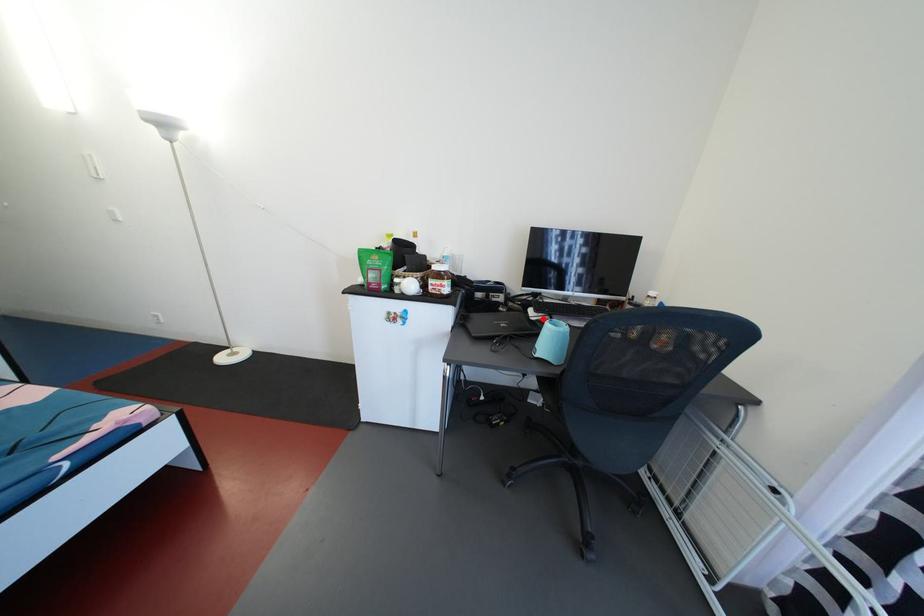
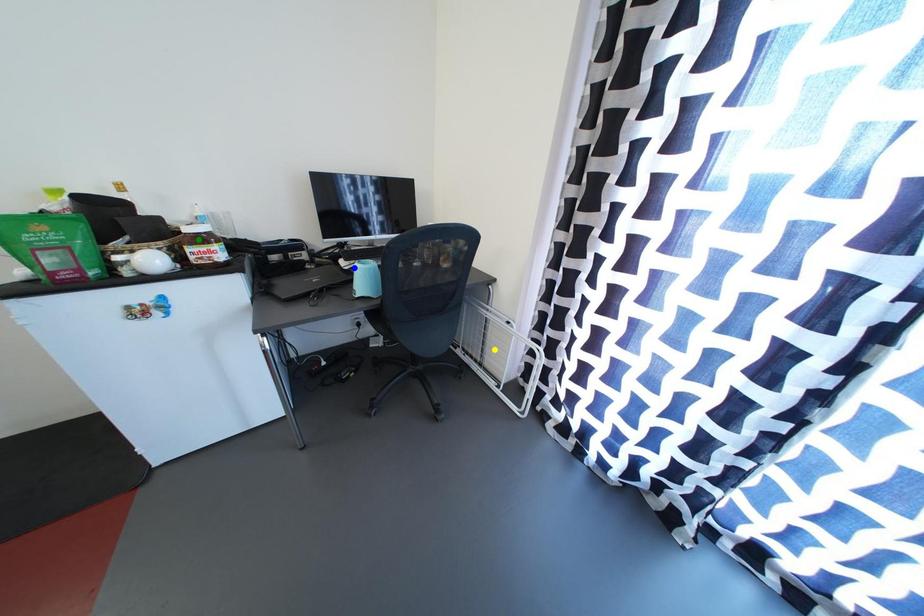
Question: I am providing you with two images of the same scene from different viewpoints. A red point is marked on the first image. You are given multiple points on the second image. Which point in image 2 is actually the same real-world point as the red point in image 1?

Choices:
 (A) yellow point
 (B) blue point
 (C) green point

Answer: (B)